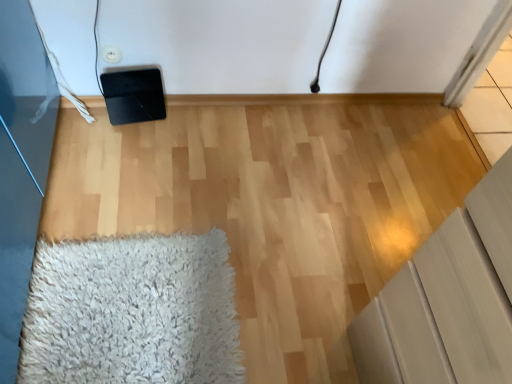
Find the location of a particular element. free spot behind white shaggy rug at lower left is located at coordinates (198, 192).